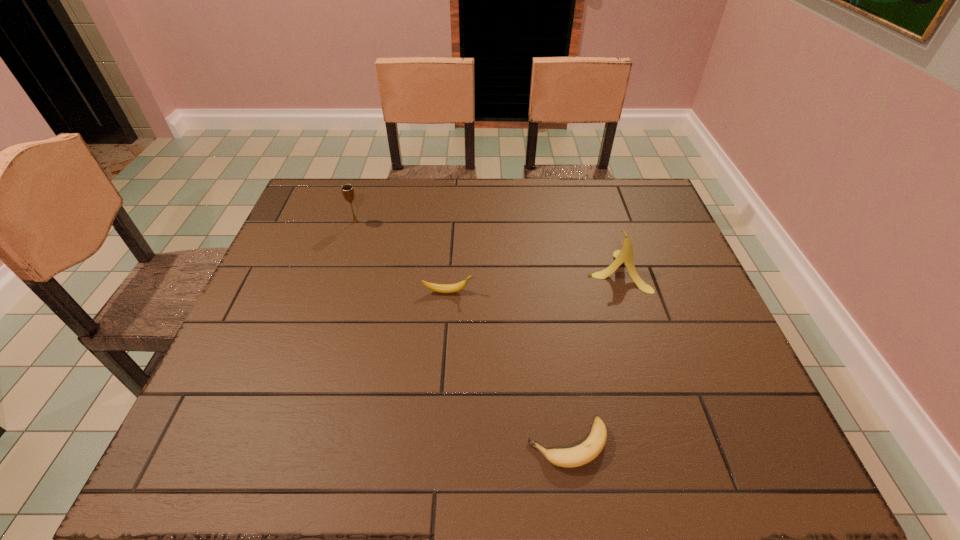
Identify the location of free space between the farthest object and the shortest object. (462, 333).

The image size is (960, 540). What are the coordinates of `vacant space that is in between the chalice and the third tallest object` in the screenshot? It's located at (401, 256).

Image resolution: width=960 pixels, height=540 pixels. Identify the location of vacant region between the rightmost object and the farthest object. (486, 246).

Identify the location of empty space between the second shortest banana and the tallest banana. (532, 281).

Locate an element on the screen. The height and width of the screenshot is (540, 960). free space between the leftmost banana and the nearest banana is located at coordinates (508, 368).

Locate an element on the screen. The width and height of the screenshot is (960, 540). free space between the chalice and the second tallest banana is located at coordinates (401, 256).

This screenshot has height=540, width=960. I want to click on free point between the second tallest banana and the tallest banana, so (532, 281).

Identify the location of free space between the second banana from right to left and the rightmost banana. This screenshot has height=540, width=960. (592, 357).

Image resolution: width=960 pixels, height=540 pixels. Identify the location of free space between the nearest banana and the second object from left to right. (508, 368).

Identify the location of vacant point located between the tallest banana and the second shortest banana. (532, 281).